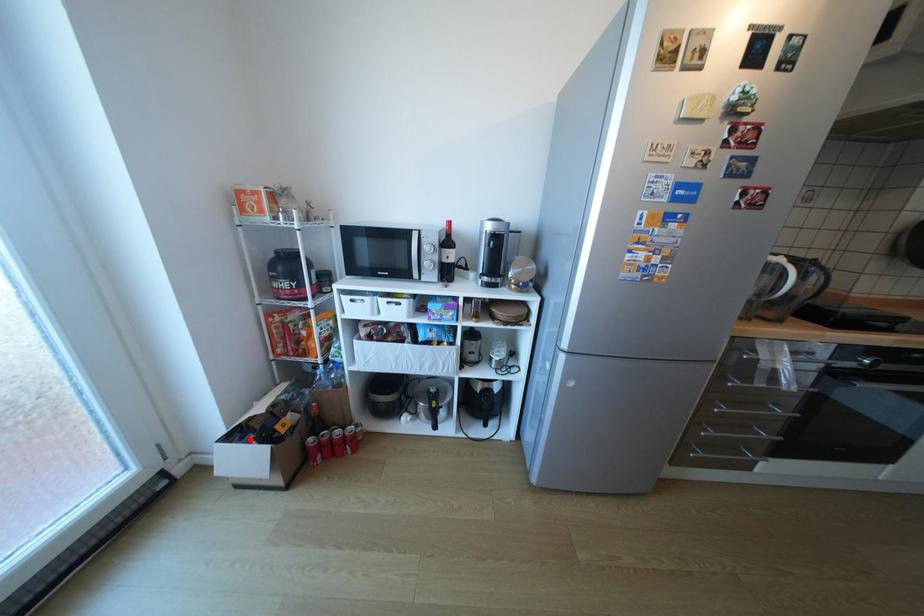
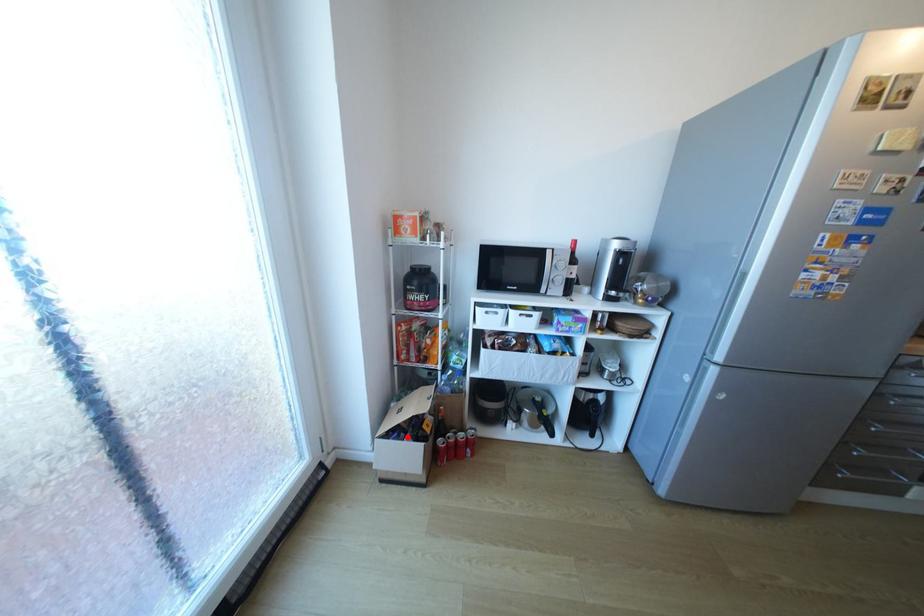
I am providing you with two images of the same scene from different viewpoints. A red point is marked on the first image and another point is marked on the second image. Do the highlighted points in image1 and image2 indicate the same real-world spot?

Yes